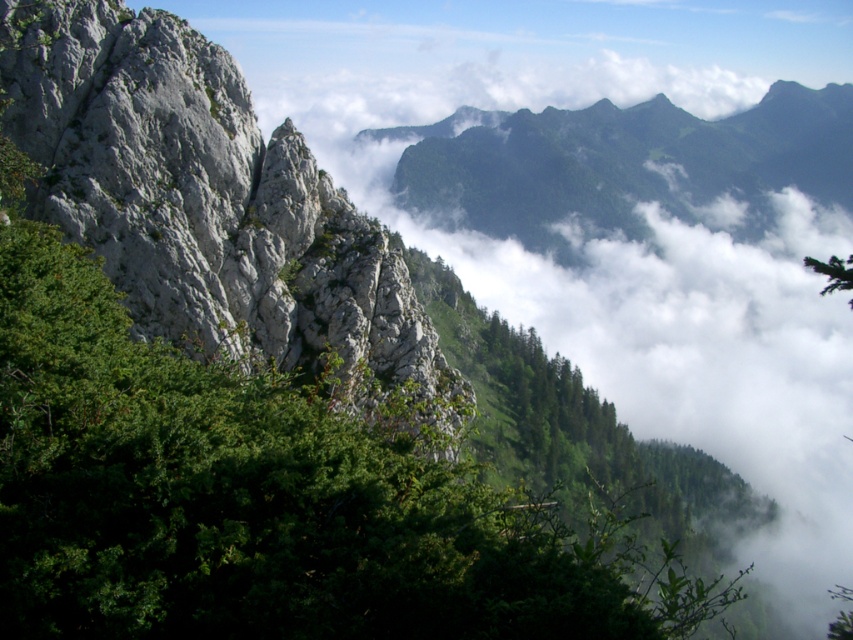
Between gray rough rock at left and green leafy tree at upper right, which one is positioned lower?

gray rough rock at left is lower down.

Describe the element at coordinates (210, 205) in the screenshot. This screenshot has height=640, width=853. I see `gray rough rock at left` at that location.

At what (x,y) coordinates should I click in order to perform the action: click on gray rough rock at left. Please return your answer as a coordinate pair (x, y). Image resolution: width=853 pixels, height=640 pixels. Looking at the image, I should click on click(210, 205).